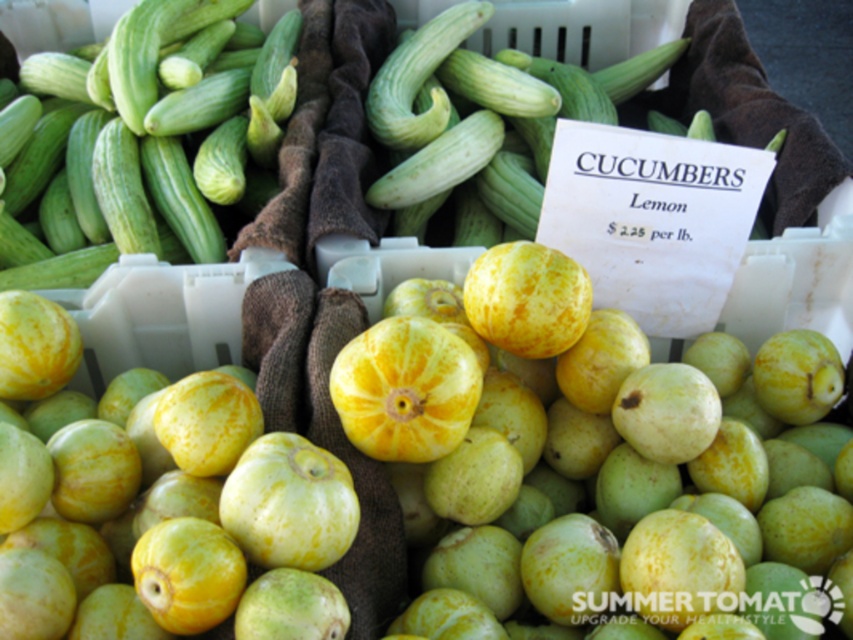
You are a customer at the market stall and want to pick up the green matte melon at center and the green matte cucumber at center. How far apart are they from each other?

The green matte melon at center is 25.67 inches away from the green matte cucumber at center.

You are standing in a market stall and see the yellow matte melon at center. You want to place a basket on the ground in front of it. If the basket is 12 inches wide, will it fit in the space between you and the melon?

The yellow matte melon at center is 29.48 inches away from the viewer. Since the basket is only 12 inches wide, there is enough space between you and the melon to place the basket.